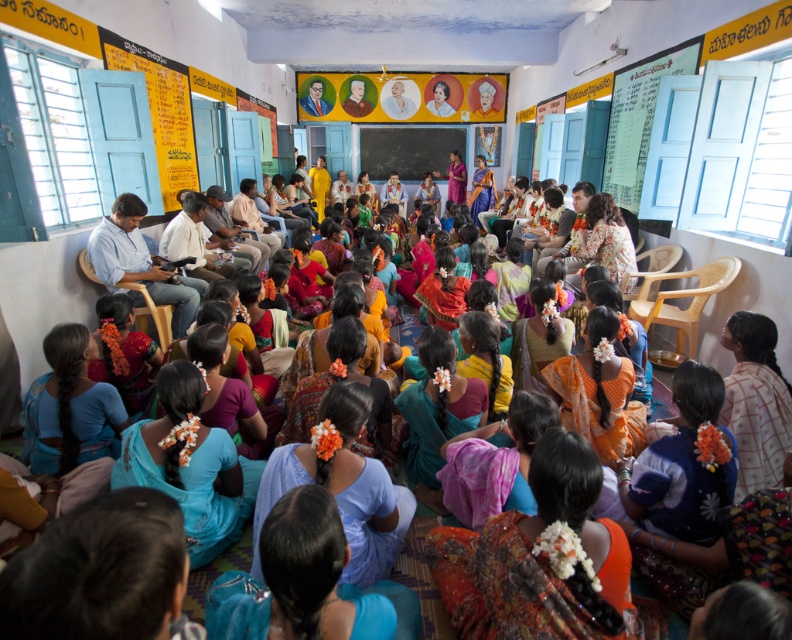
Question: Which point is closer to the camera?

Choices:
 (A) smooth wooden board at center
 (B) white paperboard at upper right
 (C) blue shirt at left

Answer: (C)

Question: Can you confirm if white paperboard at upper right is positioned to the left of blue shirt at left?

Choices:
 (A) no
 (B) yes

Answer: (A)

Question: Which point is farther to the camera?

Choices:
 (A) smooth wooden board at center
 (B) blue shirt at left

Answer: (A)

Question: Does white paperboard at upper right have a larger size compared to blue shirt at left?

Choices:
 (A) no
 (B) yes

Answer: (B)

Question: Which of the following is the farthest from the observer?

Choices:
 (A) (649, 104)
 (B) (120, 211)
 (C) (444, 152)

Answer: (C)

Question: Does white paperboard at upper right appear on the right side of smooth wooden board at center?

Choices:
 (A) no
 (B) yes

Answer: (B)